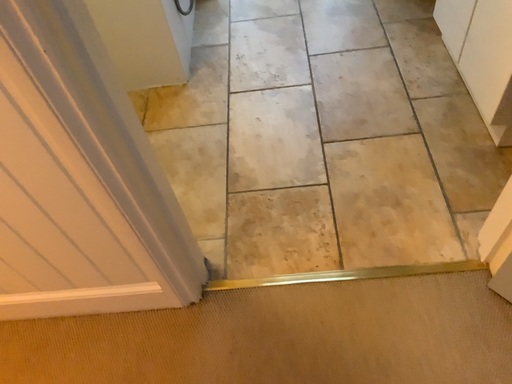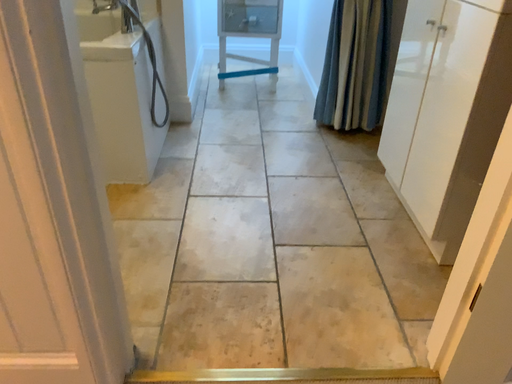
Question: Which way did the camera rotate in the video?

Choices:
 (A) rotated downward
 (B) rotated upward

Answer: (B)